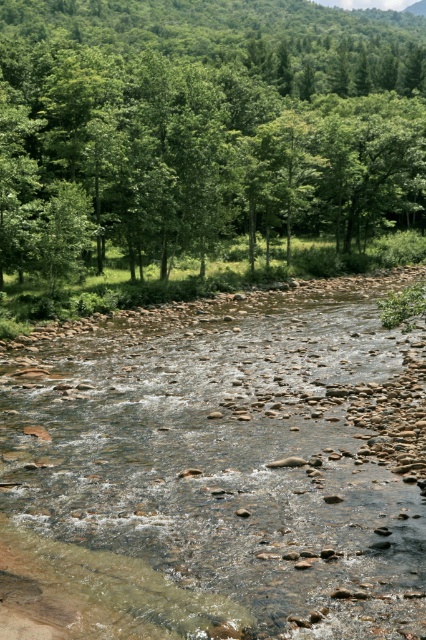
Does point (365, 589) lie behind point (17, 76)?

That is False.

Consider the image. Who is positioned more to the left, clear water at center or green leafy tree at upper center?

Positioned to the left is clear water at center.

Image resolution: width=426 pixels, height=640 pixels. In order to click on clear water at center in this screenshot , I will do `click(215, 474)`.

You are a GUI agent. You are given a task and a screenshot of the screen. Output one action in this format:
    pyautogui.click(x=<x>, y=<y>)
    Task: Click on the clear water at center
    The width and height of the screenshot is (426, 640).
    Given the screenshot: What is the action you would take?
    pyautogui.click(x=215, y=474)